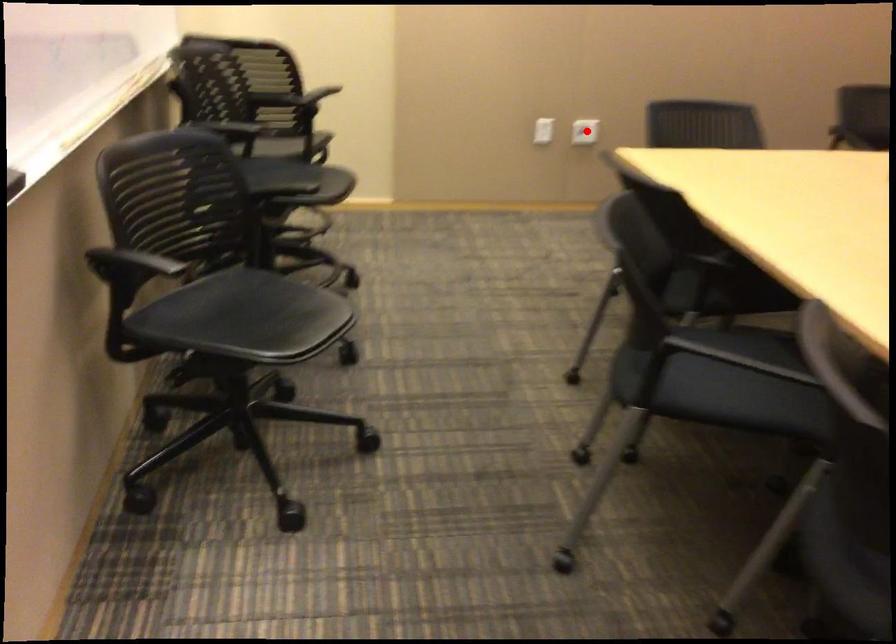
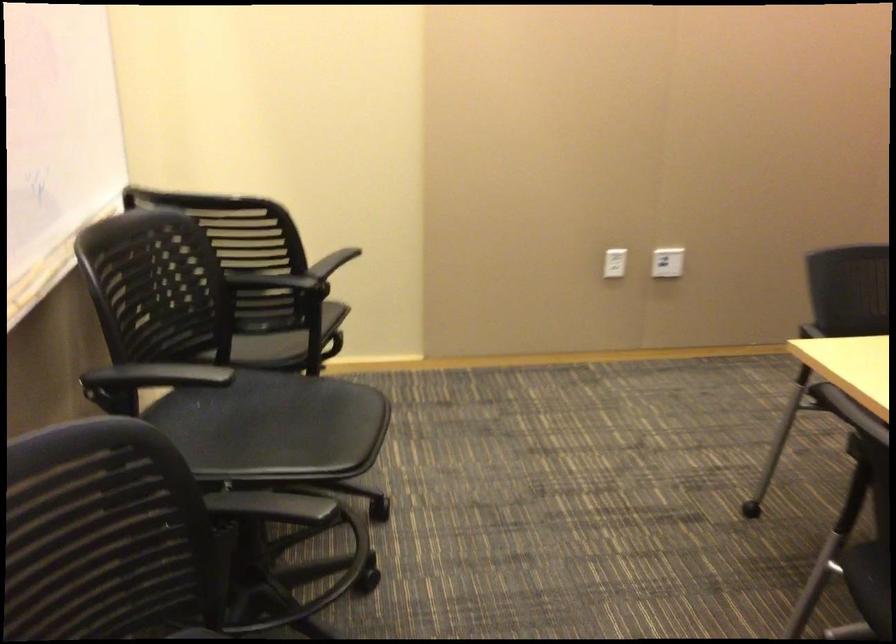
Question: I am providing you with two images of the same scene from different viewpoints. A red point is marked on the first image. Can you still see the location of the red point in image 2?

Choices:
 (A) Yes
 (B) No

Answer: (A)